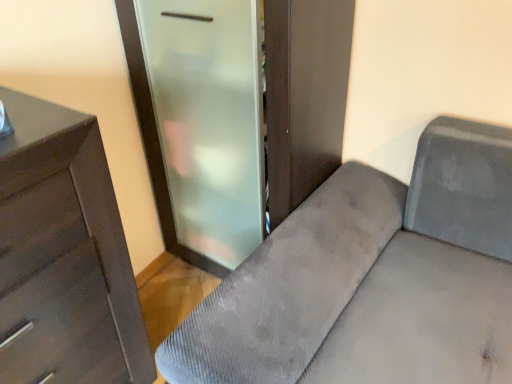
What is the approximate height of matte brown chest of drawers at left?

matte brown chest of drawers at left is 95.32 centimeters tall.

This screenshot has height=384, width=512. What do you see at coordinates (64, 255) in the screenshot?
I see `matte brown chest of drawers at left` at bounding box center [64, 255].

What is the approximate width of matte brown chest of drawers at left?

The width of matte brown chest of drawers at left is 18.03 inches.

This screenshot has width=512, height=384. What are the coordinates of `matte brown chest of drawers at left` in the screenshot? It's located at (64, 255).

Where is `matte brown chest of drawers at left`? The image size is (512, 384). matte brown chest of drawers at left is located at coordinates pyautogui.click(x=64, y=255).